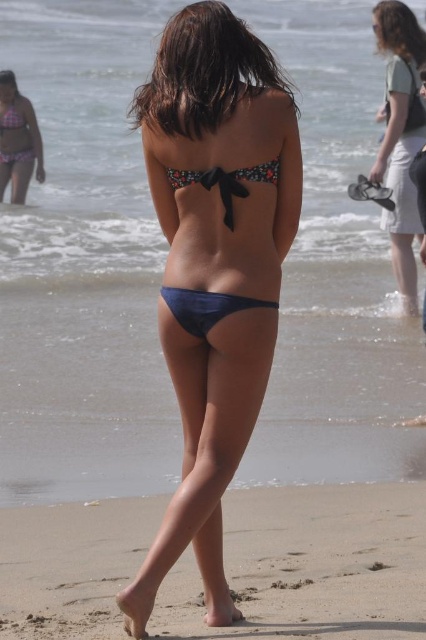
Is matte black bikini top at upper center behind floral fabric bikini top at upper center?

No, matte black bikini top at upper center is closer to the viewer.

You are a GUI agent. You are given a task and a screenshot of the screen. Output one action in this format:
    pyautogui.click(x=<x>, y=<y>)
    Task: Click on the matte black bikini top at upper center
    This screenshot has height=640, width=426.
    Given the screenshot: What is the action you would take?
    pyautogui.click(x=400, y=136)

The width and height of the screenshot is (426, 640). Identify the location of matte black bikini top at upper center. (400, 136).

Where is `matte floral bikini top at center`? The width and height of the screenshot is (426, 640). matte floral bikini top at center is located at coordinates coord(215,266).

Which is below, matte floral bikini top at center or matte black bikini top at upper center?

matte floral bikini top at center

Which is behind, point (196, 484) or point (380, 161)?

The point (380, 161) is more distant.

Where is `matte floral bikini top at center`? The width and height of the screenshot is (426, 640). matte floral bikini top at center is located at coordinates (215, 266).

Is point (394, 557) positioned after point (23, 141)?

That is False.

Locate an element on the screen. sandy tan at lower center is located at coordinates (310, 564).